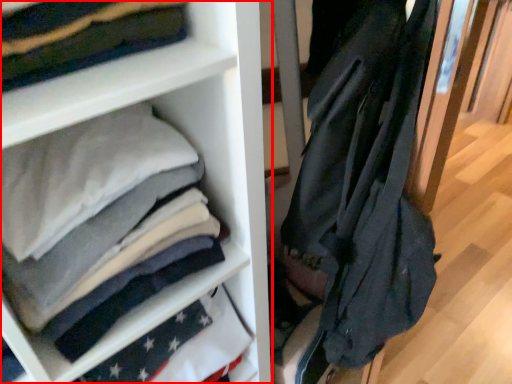
Question: From the image's perspective, what is the correct spatial relationship of shelf (annotated by the red box) in relation to garment?

Choices:
 (A) below
 (B) above

Answer: (B)